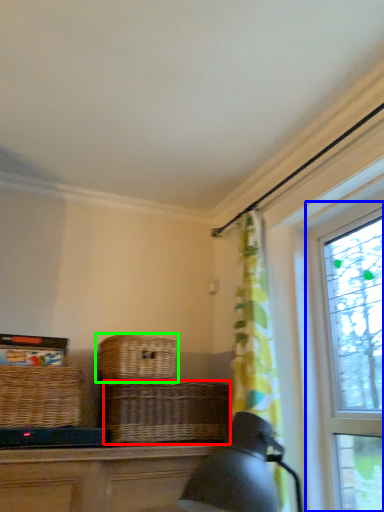
Question: Estimate the real-world distances between objects in this image. Which object is farther from basket (highlighted by a red box), window (highlighted by a blue box) or picnic basket (highlighted by a green box)?

Choices:
 (A) window
 (B) picnic basket

Answer: (A)